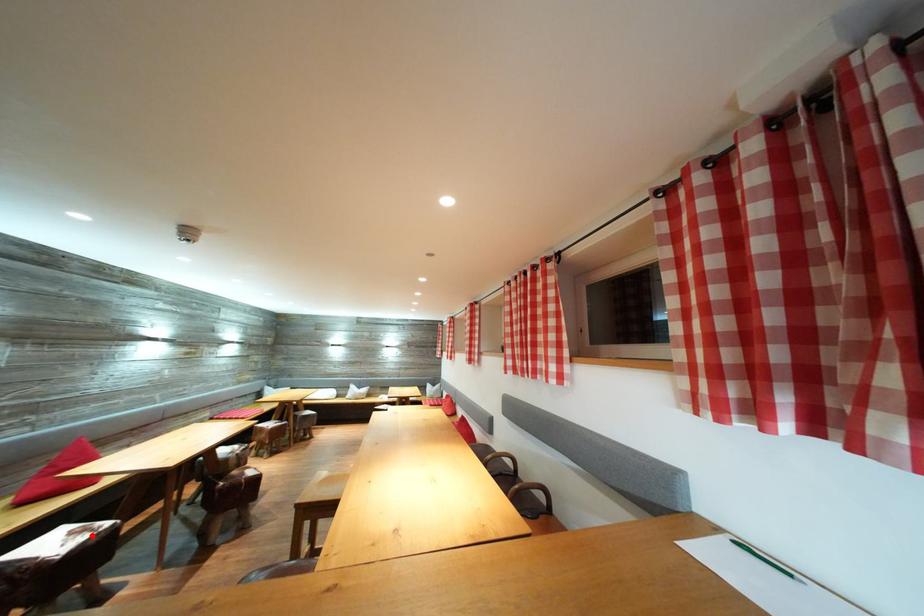
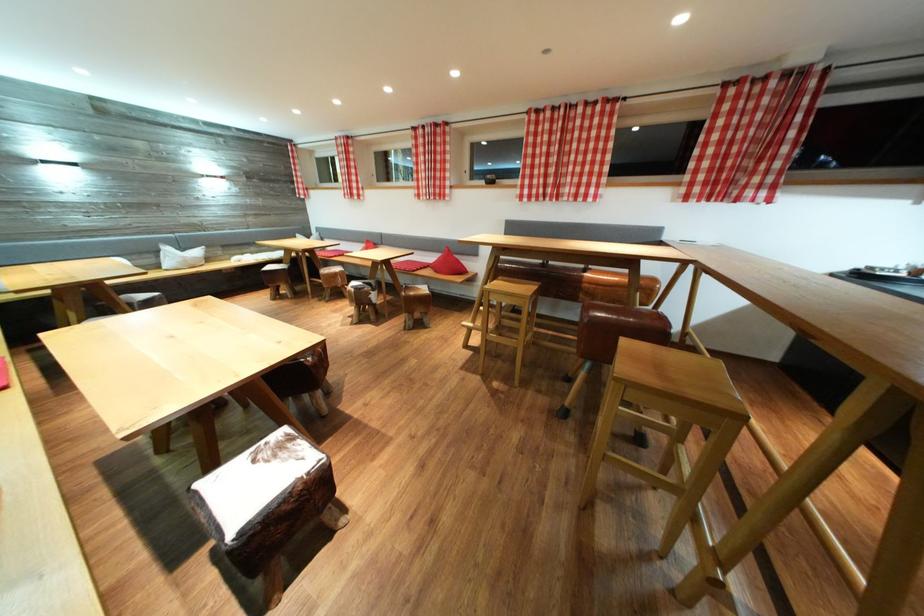
Find the pixel in the second image that matches the highlighted location in the first image.

(286, 452)